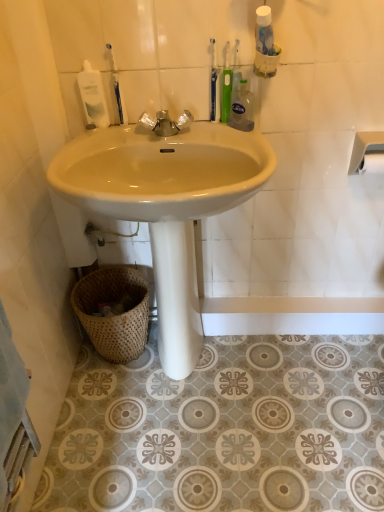
The height and width of the screenshot is (512, 384). I want to click on free space to the left of green plastic toothbrush at upper center, which is the 4th toothbrush from left to right, so click(189, 131).